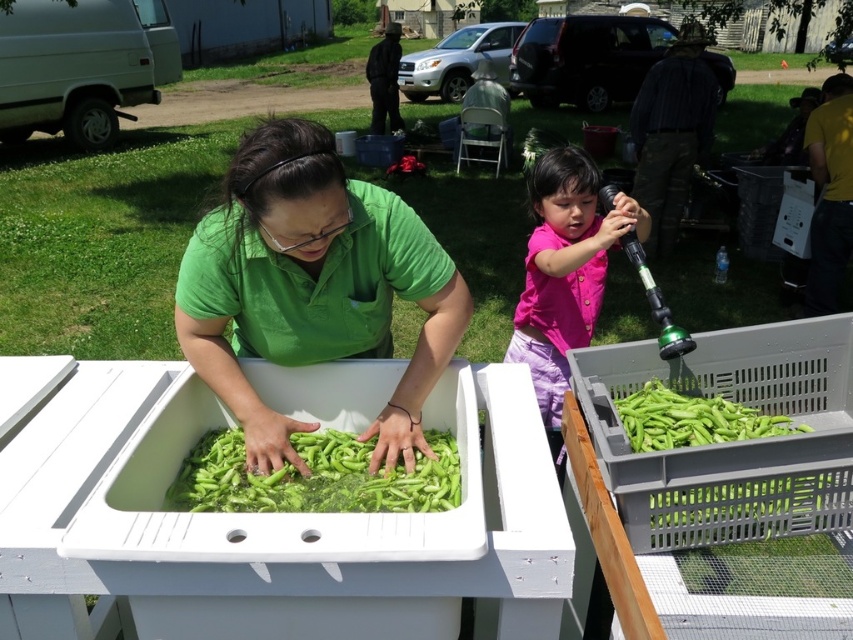
You are a photographer standing at the edge of the scene. You want to capture a closeup shot of the green plastic crate at lower right without moving any objects. Can you reach it with your camera lens from your current position?

The green plastic crate at lower right is 1.22 meters from viewer, so yes, you can reach it with your camera lens from your current position since it is within a typical camera lens range.

In the scene shown: You are a photographer trying to capture both the green matte shirt at center and the green plastic crate at lower right in a single shot. Based on their positions and sizes, do you think you can fit both into your camera frame without moving your position?

The green matte shirt at center might be wider than green plastic crate at lower right, so it depends on the shirt width. If the shirt is wider, ensure the frame accommodates its width to include both objects.

Based on the scene description, can you determine the spatial relationship between the green plastic crate at lower right and the green matte pod at right? Specifically, which one is positioned to the left?

The green plastic crate at lower right is positioned to the left of the green matte pod at right.